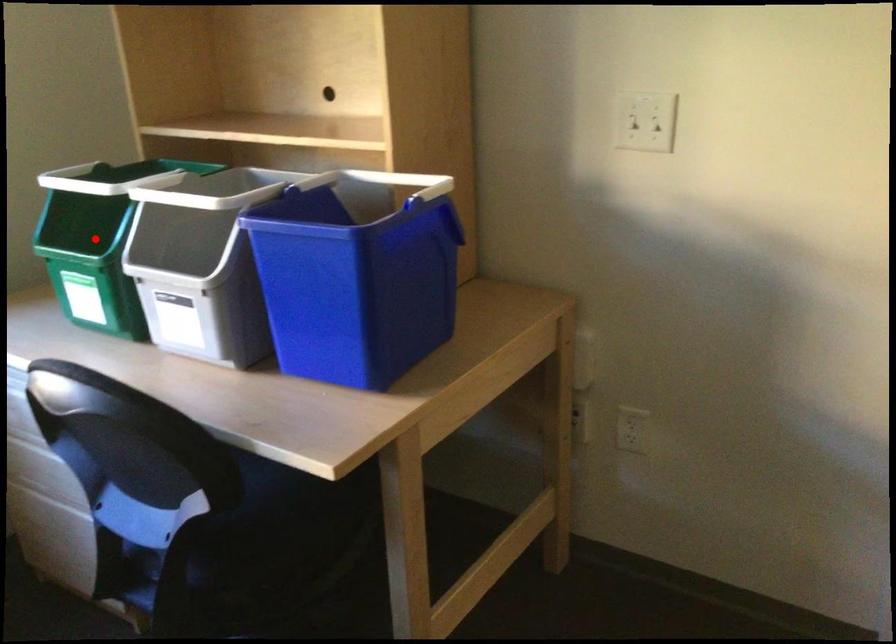
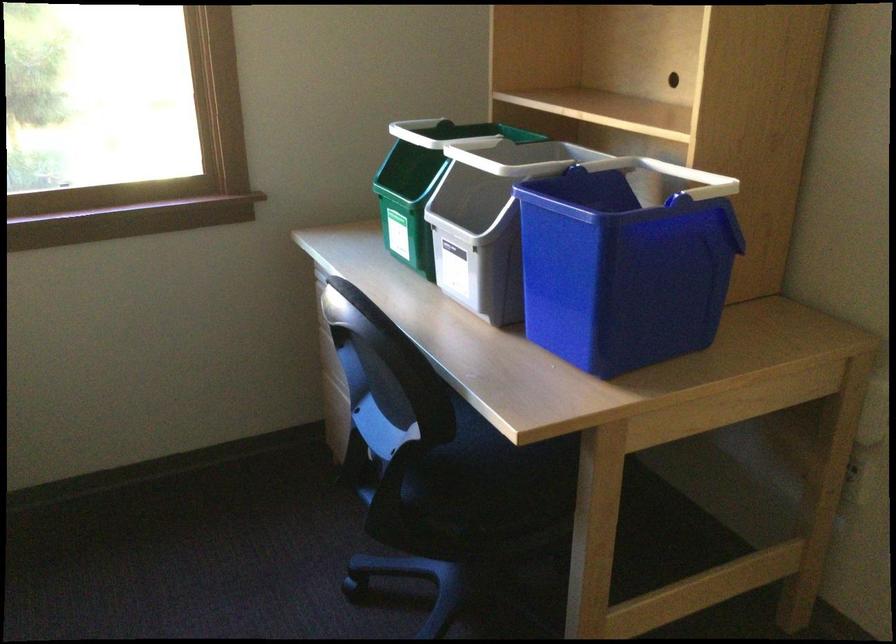
Question: A red point is marked in image1. In image2, is the corresponding 3D point closer to the camera or farther? Reply with the corresponding letter.

Choices:
 (A) The corresponding 3D point is closer.
 (B) The corresponding 3D point is farther.

Answer: (B)